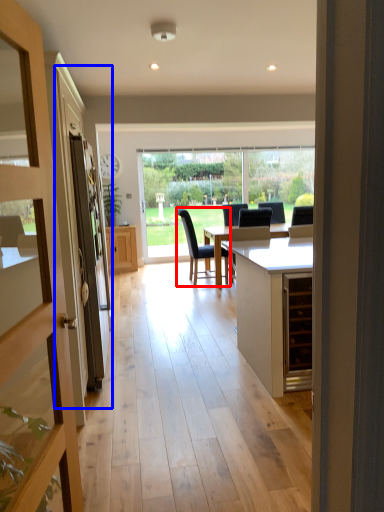
Question: Among these objects, which one is farthest to the camera, chair (highlighted by a red box) or screen door (highlighted by a blue box)?

Choices:
 (A) chair
 (B) screen door

Answer: (A)